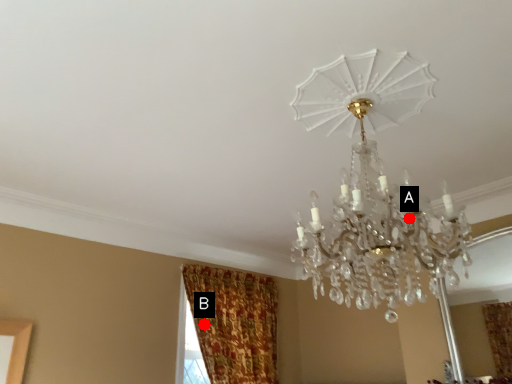
Question: Two points are circled on the image, labeled by A and B beside each circle. Among these points, which one is nearest to the camera?

Choices:
 (A) A is closer
 (B) B is closer

Answer: (A)